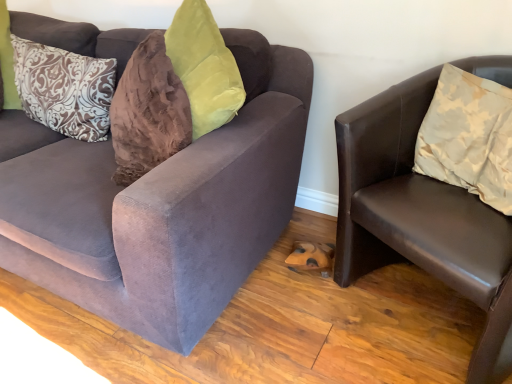
Question: From the image's perspective, is brown patterned pillow at left, the 2th pillow viewed from the right, located beneath beige satin pillow at right, marked as the second pillow in a left-to-right arrangement?

Choices:
 (A) yes
 (B) no

Answer: (B)

Question: Is brown patterned pillow at left, which appears as the first pillow when viewed from the back, thinner than beige satin pillow at right, the 2th pillow when ordered from back to front?

Choices:
 (A) yes
 (B) no

Answer: (A)

Question: Does brown patterned pillow at left, which ranks as the first pillow in left-to-right order, have a larger size compared to beige satin pillow at right, marked as the second pillow in a left-to-right arrangement?

Choices:
 (A) no
 (B) yes

Answer: (B)

Question: Is brown patterned pillow at left, which ranks as the 2th pillow in front-to-back order, positioned before beige satin pillow at right, marked as the second pillow in a left-to-right arrangement?

Choices:
 (A) no
 (B) yes

Answer: (A)

Question: Considering the relative positions of brown patterned pillow at left, which appears as the first pillow when viewed from the back, and beige satin pillow at right, the 1th pillow from the front, in the image provided, is brown patterned pillow at left, which appears as the first pillow when viewed from the back, to the left of beige satin pillow at right, the 1th pillow from the front, from the viewer's perspective?

Choices:
 (A) no
 (B) yes

Answer: (B)

Question: Considering the relative positions of velvet brown couch at left, the 2th studio couch viewed from the right, and beige satin pillow at right, the 2th pillow when ordered from back to front, in the image provided, is velvet brown couch at left, the 2th studio couch viewed from the right, to the left or to the right of beige satin pillow at right, the 2th pillow when ordered from back to front,?

Choices:
 (A) right
 (B) left

Answer: (B)

Question: From a real-world perspective, is velvet brown couch at left, arranged as the 1th studio couch when viewed from the left, above or below beige satin pillow at right, the 1th pillow from the front?

Choices:
 (A) below
 (B) above

Answer: (A)

Question: Based on their sizes in the image, would you say velvet brown couch at left, the 2th studio couch viewed from the right, is bigger or smaller than beige satin pillow at right, the 2th pillow when ordered from back to front?

Choices:
 (A) small
 (B) big

Answer: (B)

Question: From their relative heights in the image, would you say velvet brown couch at left, arranged as the 1th studio couch when viewed from the left, is taller or shorter than beige satin pillow at right, the 2th pillow when ordered from back to front?

Choices:
 (A) tall
 (B) short

Answer: (A)

Question: Is brown patterned pillow at left, which ranks as the 2th pillow in front-to-back order, inside the boundaries of beige satin pillow at right, the 1th pillow from the front, or outside?

Choices:
 (A) outside
 (B) inside

Answer: (A)

Question: Is brown patterned pillow at left, which ranks as the 2th pillow in front-to-back order, bigger or smaller than beige satin pillow at right, the 2th pillow when ordered from back to front?

Choices:
 (A) big
 (B) small

Answer: (A)

Question: Would you say brown patterned pillow at left, which ranks as the first pillow in left-to-right order, is to the left or to the right of beige satin pillow at right, the first pillow when ordered from right to left, in the picture?

Choices:
 (A) right
 (B) left

Answer: (B)

Question: From the image's perspective, is brown patterned pillow at left, the 2th pillow viewed from the right, located above or below beige satin pillow at right, the 1th pillow from the front?

Choices:
 (A) above
 (B) below

Answer: (A)

Question: Is point (62, 109) closer or farther from the camera than point (382, 261)?

Choices:
 (A) farther
 (B) closer

Answer: (A)

Question: Looking at their shapes, would you say brown patterned pillow at left, which ranks as the 2th pillow in front-to-back order, is wider or thinner than brown leather chair at right, the first studio couch viewed from the right?

Choices:
 (A) thin
 (B) wide

Answer: (A)